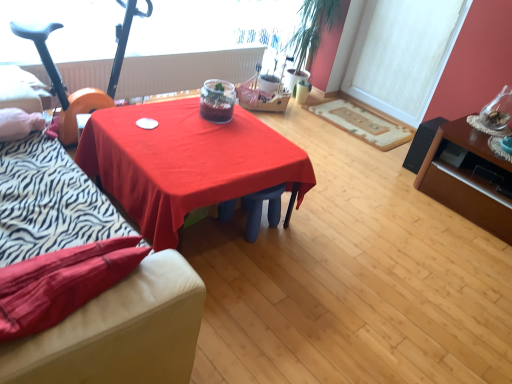
Question: Can you confirm if matte black speaker at right, the second table positioned from the left, is smaller than white textured window screen at upper right?

Choices:
 (A) no
 (B) yes

Answer: (A)

Question: Can you confirm if matte black speaker at right, the second table positioned from the left, is thinner than white textured window screen at upper right?

Choices:
 (A) no
 (B) yes

Answer: (A)

Question: Does matte black speaker at right, the second table positioned from the left, have a larger size compared to white textured window screen at upper right?

Choices:
 (A) no
 (B) yes

Answer: (B)

Question: From a real-world perspective, is matte black speaker at right, acting as the 1th table starting from the right, physically above white textured window screen at upper right?

Choices:
 (A) no
 (B) yes

Answer: (A)

Question: Is matte black speaker at right, the second table positioned from the left, far from white textured window screen at upper right?

Choices:
 (A) yes
 (B) no

Answer: (A)

Question: Considering the positions of translucent glass jar at center and matte red tablecloth at center, which is counted as the 2th table, starting from the right, in the image, is translucent glass jar at center taller or shorter than matte red tablecloth at center, which is counted as the 2th table, starting from the right,?

Choices:
 (A) short
 (B) tall

Answer: (A)

Question: Looking at their shapes, would you say translucent glass jar at center is wider or thinner than matte red tablecloth at center, which ranks as the 1th table in left-to-right order?

Choices:
 (A) wide
 (B) thin

Answer: (B)

Question: From the image's perspective, relative to matte red tablecloth at center, which ranks as the 1th table in left-to-right order, is translucent glass jar at center above or below?

Choices:
 (A) above
 (B) below

Answer: (A)

Question: Is translucent glass jar at center in front of or behind matte red tablecloth at center, which is counted as the 2th table, starting from the right, in the image?

Choices:
 (A) front
 (B) behind

Answer: (B)

Question: Considering the positions of point (411, 89) and point (129, 18), is point (411, 89) closer or farther from the camera than point (129, 18)?

Choices:
 (A) closer
 (B) farther

Answer: (B)

Question: Would you say white textured window screen at upper right is inside or outside orange rubber baby carriage at left?

Choices:
 (A) outside
 (B) inside

Answer: (A)

Question: From the image's perspective, is white textured window screen at upper right positioned above or below orange rubber baby carriage at left?

Choices:
 (A) above
 (B) below

Answer: (A)

Question: Considering the positions of white textured window screen at upper right and orange rubber baby carriage at left in the image, is white textured window screen at upper right bigger or smaller than orange rubber baby carriage at left?

Choices:
 (A) big
 (B) small

Answer: (B)

Question: Looking at the image, does velvet-like red couch at lower left seem bigger or smaller compared to matte red tablecloth at center, which ranks as the 1th table in left-to-right order?

Choices:
 (A) small
 (B) big

Answer: (A)

Question: Is velvet-like red couch at lower left situated inside matte red tablecloth at center, which ranks as the 1th table in left-to-right order, or outside?

Choices:
 (A) inside
 (B) outside

Answer: (B)